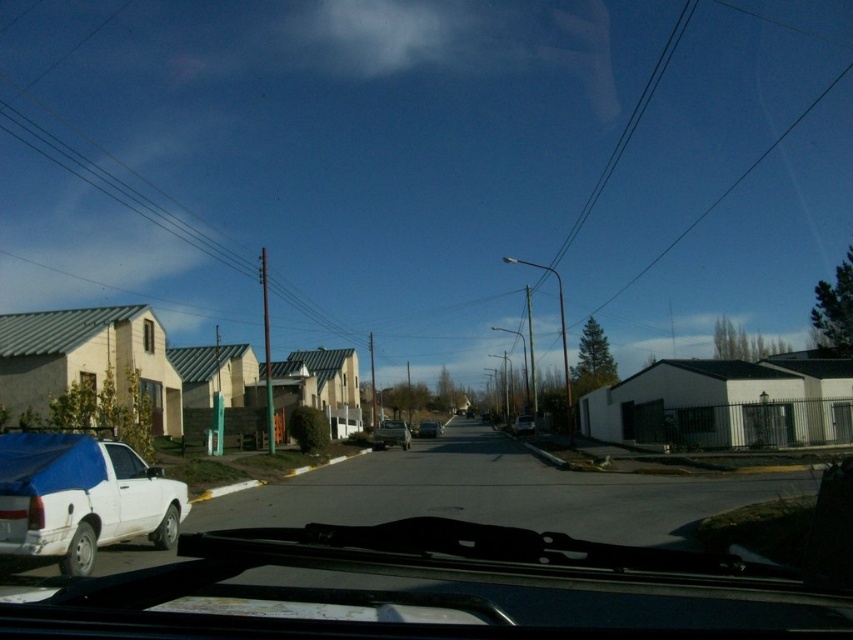
Question: Is white matte car window at lower left positioned at the back of matte black car at center?

Choices:
 (A) no
 (B) yes

Answer: (A)

Question: Which point is farther from the camera taking this photo?

Choices:
 (A) (410, 438)
 (B) (440, 428)
 (C) (529, 417)
 (D) (84, 492)

Answer: (B)

Question: Which point is closer to the camera?

Choices:
 (A) (131, 472)
 (B) (438, 422)
 (C) (390, 422)
 (D) (82, 522)

Answer: (D)

Question: Based on their relative distances, which object is farther from the white matte truck at left?

Choices:
 (A) matte black car at center
 (B) silver metallic car at center
 (C) white matte car window at lower left

Answer: (A)

Question: Can you confirm if white matte car window at lower left is smaller than matte black car at center?

Choices:
 (A) no
 (B) yes

Answer: (B)

Question: Can you confirm if white matte car window at lower left is smaller than metallic silver sedan at center?

Choices:
 (A) no
 (B) yes

Answer: (B)